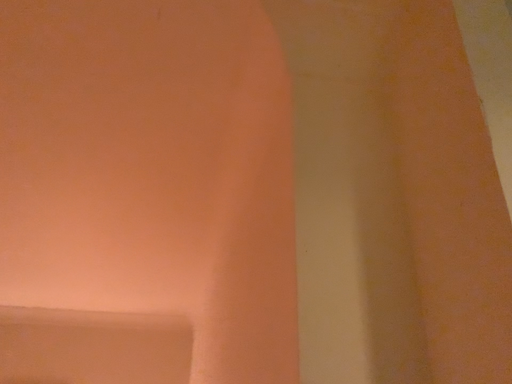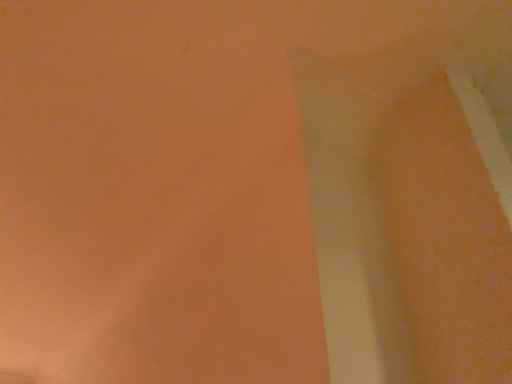
Question: Which way did the camera rotate in the video?

Choices:
 (A) rotated right
 (B) rotated left

Answer: (A)